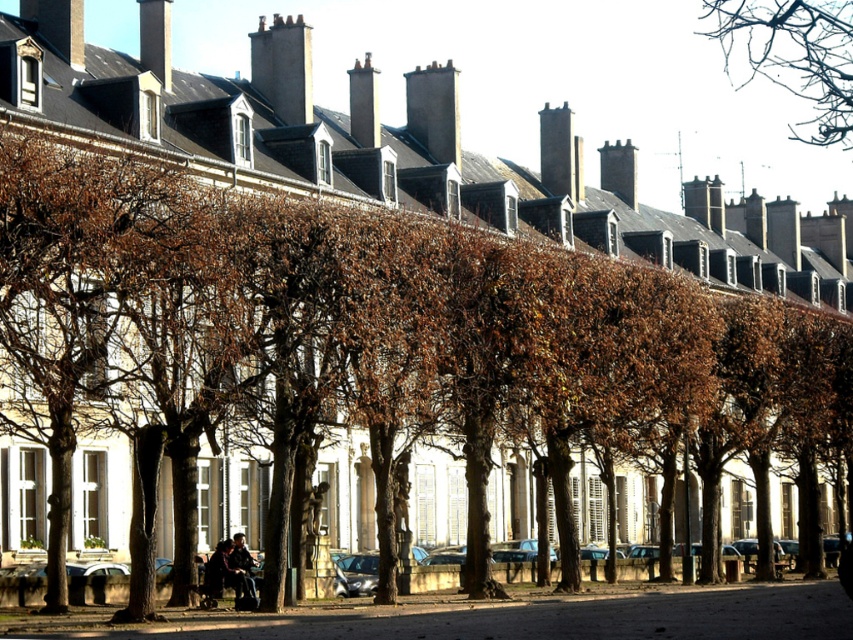
Does brown leafless branches at upper right appear on the right side of dark blue jeans at lower center?

Yes, brown leafless branches at upper right is to the right of dark blue jeans at lower center.

Is brown leafless branches at upper right wider than dark blue jeans at lower center?

Yes, brown leafless branches at upper right is wider than dark blue jeans at lower center.

This screenshot has width=853, height=640. I want to click on brown leafless branches at upper right, so click(793, 54).

Image resolution: width=853 pixels, height=640 pixels. What are the coordinates of `brown leafless branches at upper right` in the screenshot? It's located at (793, 54).